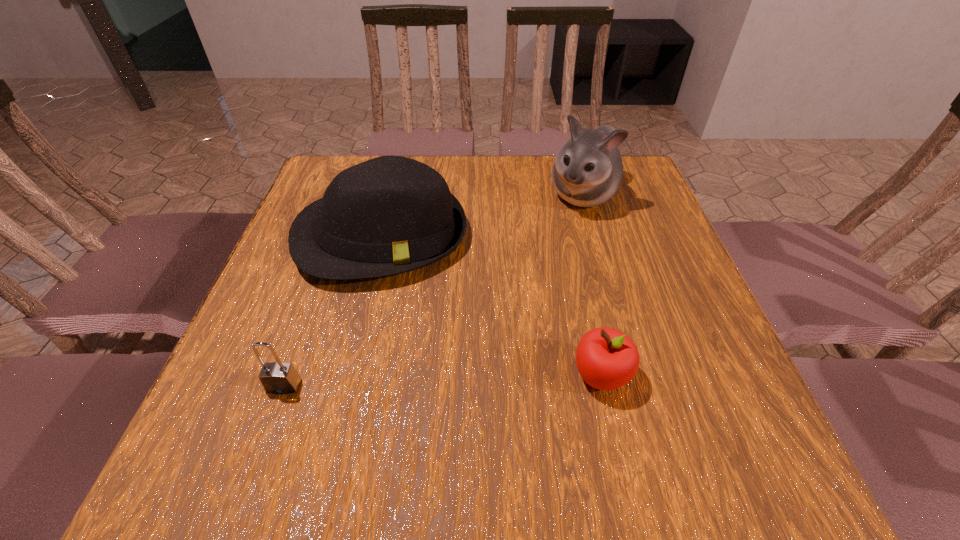
You are a GUI agent. You are given a task and a screenshot of the screen. Output one action in this format:
    pyautogui.click(x=<x>, y=<y>)
    Task: Click on the free space on the desktop that is between the padlock and the apple and is positioned on the face of the hamster
    The height and width of the screenshot is (540, 960).
    Given the screenshot: What is the action you would take?
    pyautogui.click(x=453, y=380)

At what (x,y) coordinates should I click in order to perform the action: click on free space on the desktop that is between the padlock and the apple and is positioned on the front-facing side of the second tallest object. Please return your answer as a coordinate pair (x, y). The image size is (960, 540). Looking at the image, I should click on (416, 381).